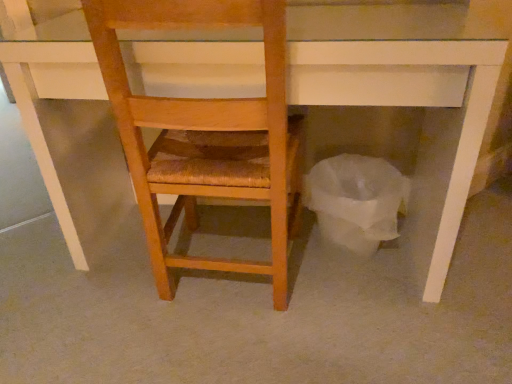
At what (x,y) coordinates should I click in order to perform the action: click on blank space to the left of wooden chair at center. Please return your answer as a coordinate pair (x, y). This screenshot has width=512, height=384. Looking at the image, I should click on (106, 289).